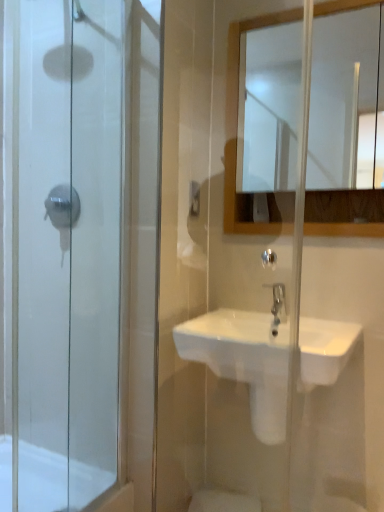
What do you see at coordinates (41, 479) in the screenshot? I see `white glossy bath at lower left` at bounding box center [41, 479].

Measure the distance between transparent glass shower door at left and camera.

transparent glass shower door at left and camera are 1.30 meters apart from each other.

The width and height of the screenshot is (384, 512). Describe the element at coordinates (278, 302) in the screenshot. I see `satin nickel faucet at center` at that location.

The width and height of the screenshot is (384, 512). Find the location of `white glossy bath at lower left`. white glossy bath at lower left is located at coordinates (41, 479).

Could you tell me if white glossy sink at center is facing transparent glass shower door at left?

No, white glossy sink at center is not aimed at transparent glass shower door at left.

This screenshot has height=512, width=384. Find the location of `sink behind the transparent glass shower door at left`. sink behind the transparent glass shower door at left is located at coordinates (244, 361).

Which object is wider, white glossy sink at center or transparent glass shower door at left?

With larger width is white glossy sink at center.

Does white glossy sink at center appear on the right side of transparent glass shower door at left?

Correct, you'll find white glossy sink at center to the right of transparent glass shower door at left.

You are a GUI agent. You are given a task and a screenshot of the screen. Output one action in this format:
    pyautogui.click(x=<x>, y=<y>)
    Task: Click on the screen door on the left side of satin nickel faucet at center
    Image resolution: width=384 pixels, height=512 pixels.
    Given the screenshot: What is the action you would take?
    pyautogui.click(x=78, y=250)

Is satin nickel faucet at center oriented away from transparent glass shower door at left?

No, satin nickel faucet at center's orientation is not away from transparent glass shower door at left.

From a real-world perspective, which is physically above, satin nickel faucet at center or transparent glass shower door at left?

In real-world perspective, transparent glass shower door at left is above.

Is white glossy sink at center shorter than white glossy bath at lower left?

Incorrect, the height of white glossy sink at center does not fall short of that of white glossy bath at lower left.

Consider the image. Between white glossy sink at center and white glossy bath at lower left, which one has larger size?

With larger size is white glossy sink at center.

Looking at this image, from the image's perspective, which object appears higher, white glossy sink at center or white glossy bath at lower left?

white glossy sink at center appears higher in the image.

Can you tell me how much white glossy sink at center and white glossy bath at lower left differ in facing direction?

There is a 89.4-degree angle between the facing directions of white glossy sink at center and white glossy bath at lower left.

Does white glossy mirror at upper center have a greater width compared to transparent glass shower door at left?

Incorrect, the width of white glossy mirror at upper center does not surpass that of transparent glass shower door at left.

How many degrees apart are the facing directions of white glossy mirror at upper center and transparent glass shower door at left?

white glossy mirror at upper center and transparent glass shower door at left are facing 90.6 degrees away from each other.

Is transparent glass shower door at left at the back of white glossy mirror at upper center?

white glossy mirror at upper center is not turned away from transparent glass shower door at left.

Does white glossy mirror at upper center appear on the left side of transparent glass shower door at left?

In fact, white glossy mirror at upper center is to the right of transparent glass shower door at left.

Which is behind, white glossy mirror at upper center or white glossy bath at lower left?

white glossy mirror at upper center is further from the camera.

Considering the points (356, 111) and (36, 501), which point is in front, point (356, 111) or point (36, 501)?

Positioned in front is point (36, 501).

Is white glossy mirror at upper center not close to white glossy bath at lower left?

white glossy mirror at upper center is positioned a significant distance from white glossy bath at lower left.

Which of these two, white glossy mirror at upper center or white glossy bath at lower left, stands taller?

Standing taller between the two is white glossy mirror at upper center.

Is white glossy bath at lower left next to white glossy mirror at upper center and touching it?

white glossy bath at lower left is not next to white glossy mirror at upper center, and they're not touching.

From a real-world perspective, is white glossy bath at lower left over white glossy mirror at upper center?

No, from a real-world perspective, white glossy bath at lower left is not above white glossy mirror at upper center.

Can you confirm if white glossy bath at lower left is taller than white glossy mirror at upper center?

No, white glossy bath at lower left is not taller than white glossy mirror at upper center.

Which is behind, transparent glass shower door at left or white glossy bath at lower left?

white glossy bath at lower left.

Between transparent glass shower door at left and white glossy bath at lower left, which one has more height?

Standing taller between the two is transparent glass shower door at left.

Considering the positions of points (114, 499) and (1, 438), is point (114, 499) farther from camera compared to point (1, 438)?

No.

Does transparent glass shower door at left have a greater width compared to white glossy bath at lower left?

Incorrect, the width of transparent glass shower door at left does not surpass that of white glossy bath at lower left.

This screenshot has height=512, width=384. I want to click on screen door above the white glossy sink at center (from a real-world perspective), so click(78, 250).

Find the location of a particular element. This screenshot has width=384, height=512. tap that is behind the transparent glass shower door at left is located at coordinates (278, 302).

Consider the image. From the image, which object appears to be farther from transparent glass shower door at left, white glossy sink at center or white glossy bath at lower left?

The object further to transparent glass shower door at left is white glossy sink at center.

From the image, which object appears to be nearer to white glossy bath at lower left, satin nickel faucet at center or transparent glass shower door at left?

The object closer to white glossy bath at lower left is transparent glass shower door at left.

Estimate the real-world distances between objects in this image. Which object is further from satin nickel faucet at center, white glossy sink at center or white glossy mirror at upper center?

white glossy mirror at upper center is positioned further to the anchor satin nickel faucet at center.

When comparing their distances from white glossy mirror at upper center, does satin nickel faucet at center or white glossy bath at lower left seem further?

white glossy bath at lower left lies further to white glossy mirror at upper center than the other object.

Based on their spatial positions, is white glossy bath at lower left or transparent glass shower door at left closer to white glossy mirror at upper center?

transparent glass shower door at left.

From the image, which object appears to be nearer to white glossy sink at center, white glossy mirror at upper center or white glossy bath at lower left?

Based on the image, white glossy bath at lower left appears to be nearer to white glossy sink at center.

Estimate the real-world distances between objects in this image. Which object is closer to satin nickel faucet at center, transparent glass shower door at left or white glossy mirror at upper center?

transparent glass shower door at left is positioned closer to the anchor satin nickel faucet at center.

Considering their positions, is white glossy sink at center positioned further to white glossy mirror at upper center than satin nickel faucet at center?

Based on the image, satin nickel faucet at center appears to be further to white glossy mirror at upper center.

Locate an element on the screen. This screenshot has height=512, width=384. screen door between white glossy mirror at upper center and white glossy bath at lower left from top to bottom is located at coordinates (78, 250).

Where is `tap between white glossy mirror at upper center and white glossy bath at lower left in the vertical direction`? The height and width of the screenshot is (512, 384). tap between white glossy mirror at upper center and white glossy bath at lower left in the vertical direction is located at coordinates (278, 302).

The height and width of the screenshot is (512, 384). What are the coordinates of `sink between white glossy bath at lower left and satin nickel faucet at center in the horizontal direction` in the screenshot? It's located at (244, 361).

In order to click on sink that lies between white glossy mirror at upper center and white glossy bath at lower left from top to bottom in this screenshot , I will do `click(244, 361)`.